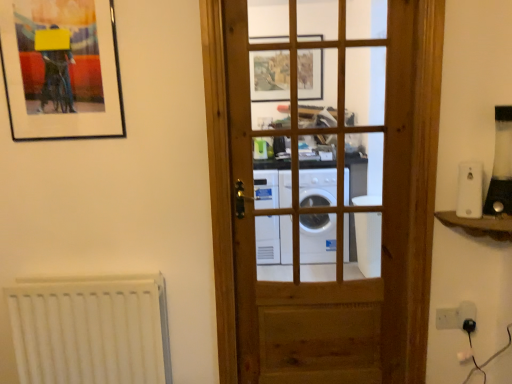
Question: Is white plastic light switch at lower right taller or shorter than white plastic light switch at right, which is the 1th appliance from left to right?

Choices:
 (A) tall
 (B) short

Answer: (B)

Question: Is white plastic light switch at lower right in front of or behind white plastic light switch at right, the second appliance from the right, in the image?

Choices:
 (A) front
 (B) behind

Answer: (B)

Question: Estimate the real-world distances between objects in this image. Which object is farther from the white plastic electric outlet at lower right?

Choices:
 (A) white plastic light switch at lower right
 (B) black plastic blender at right, the second appliance from the left
 (C) matte black picture frame at upper left
 (D) wooden door at center
 (E) white matte radiator at lower left

Answer: (C)

Question: Considering the real-world distances, which object is closest to the black plastic blender at right, marked as the 1th appliance in a right-to-left arrangement?

Choices:
 (A) wooden door at center
 (B) white plastic light switch at lower right
 (C) white matte radiator at lower left
 (D) matte black picture frame at upper left
 (E) white plastic electric outlet at lower right

Answer: (E)